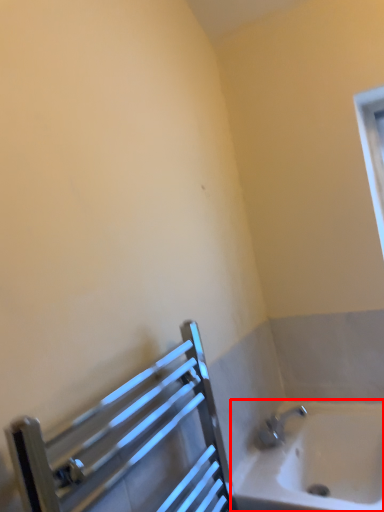
Question: From the image's perspective, considering the relative positions of bathtub (annotated by the red box) and balustrade in the image provided, where is bathtub (annotated by the red box) located with respect to the staircase?

Choices:
 (A) below
 (B) above

Answer: (A)